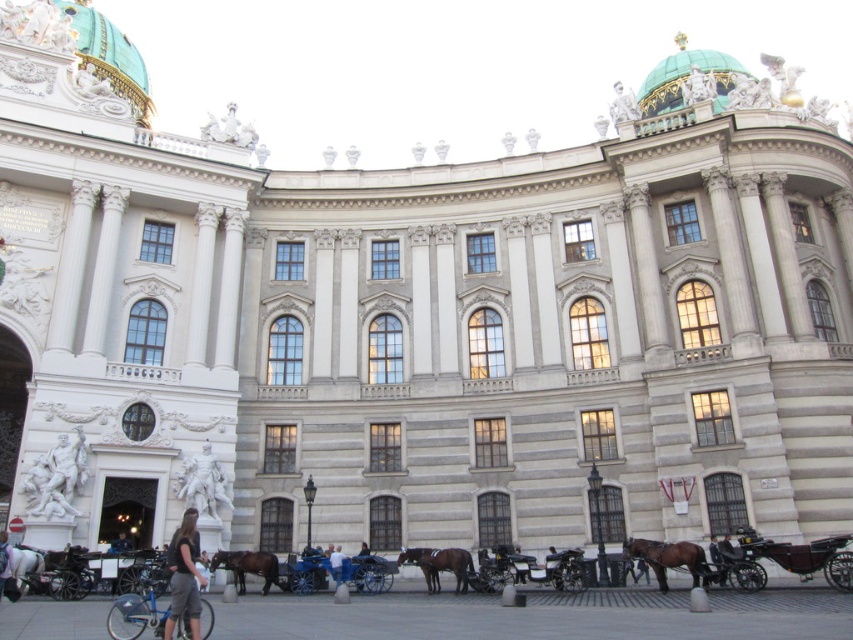
You are a tour guide leading a group near the grand neoclassical building. You notice the brown glossy horse at lower right and the blue denim jeans at lower center. Which object is bigger?

The brown glossy horse at lower right is larger in size compared to the blue denim jeans at lower center.

You are standing in front of the grand neoclassical building and want to take a photo. You notice two points marked in the scene. The first point is at coordinates point [688,552] and the second is at point [332,568]. Which point is closer to your camera when taking the photo?

Point [688,552] is closer to the camera than point [332,568].

You are a photographer standing in front of the grand neoclassical building. You notice two elements in the scene that you want to capture in your photo. One is the dark gray fabric pants at lower left and the other is the brown glossy horse at lower center. Which of these two objects is taller in the image?

The dark gray fabric pants at lower left is taller than the brown glossy horse at lower center according to the description provided.